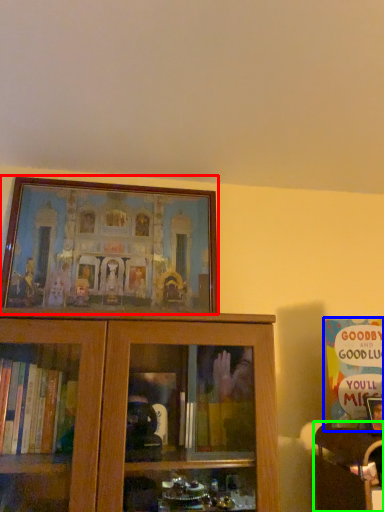
Question: Considering the real-world distances, which object is closest to picture frame (highlighted by a red box)? book (highlighted by a blue box) or furniture (highlighted by a green box).

Choices:
 (A) book
 (B) furniture

Answer: (A)